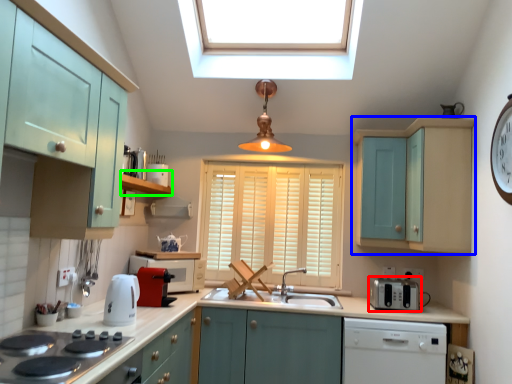
Question: Which is nearer to the appliance (highlighted by a red box)? cabinetry (highlighted by a blue box) or shelf (highlighted by a green box).

Choices:
 (A) cabinetry
 (B) shelf

Answer: (A)